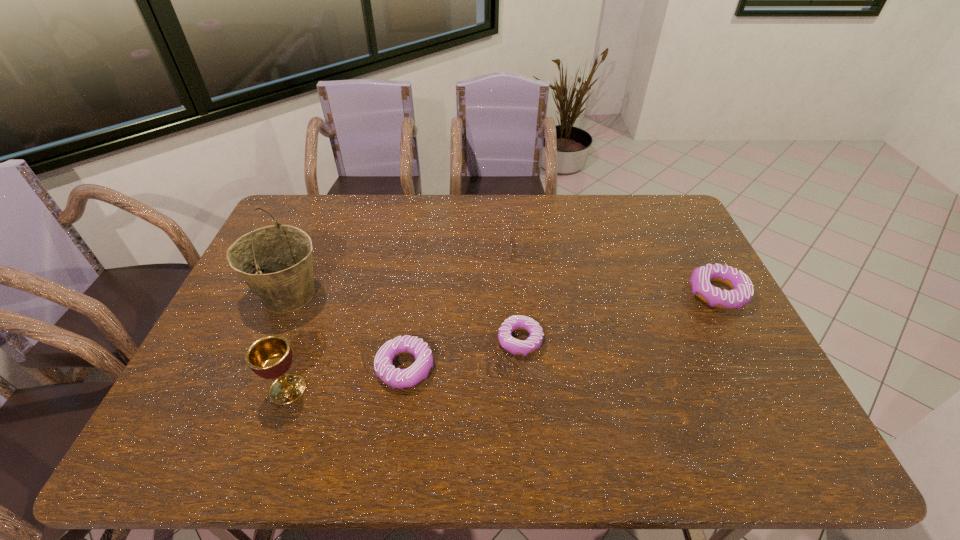
You are a GUI agent. You are given a task and a screenshot of the screen. Output one action in this format:
    pyautogui.click(x=<x>, y=<y>)
    Task: Click on the free space that satisfies the following two spatial constraints: 1. on the temples of the rightmost object; 2. on the left side of the farthest object
    The width and height of the screenshot is (960, 540).
    Given the screenshot: What is the action you would take?
    pyautogui.click(x=534, y=294)

At what (x,y) coordinates should I click in order to perform the action: click on vacant space that satisfies the following two spatial constraints: 1. on the front side of the fifth shortest object; 2. on the right side of the wine bucket. Please return your answer as a coordinate pair (x, y). This screenshot has height=540, width=960. Looking at the image, I should click on (249, 389).

This screenshot has height=540, width=960. Identify the location of vacant position in the image that satisfies the following two spatial constraints: 1. on the temples of the rightmost doughnut; 2. on the left side of the spectacles. (534, 294).

The image size is (960, 540). I want to click on vacant region that satisfies the following two spatial constraints: 1. on the temples of the farthest doughnut; 2. on the right side of the farthest object, so click(534, 294).